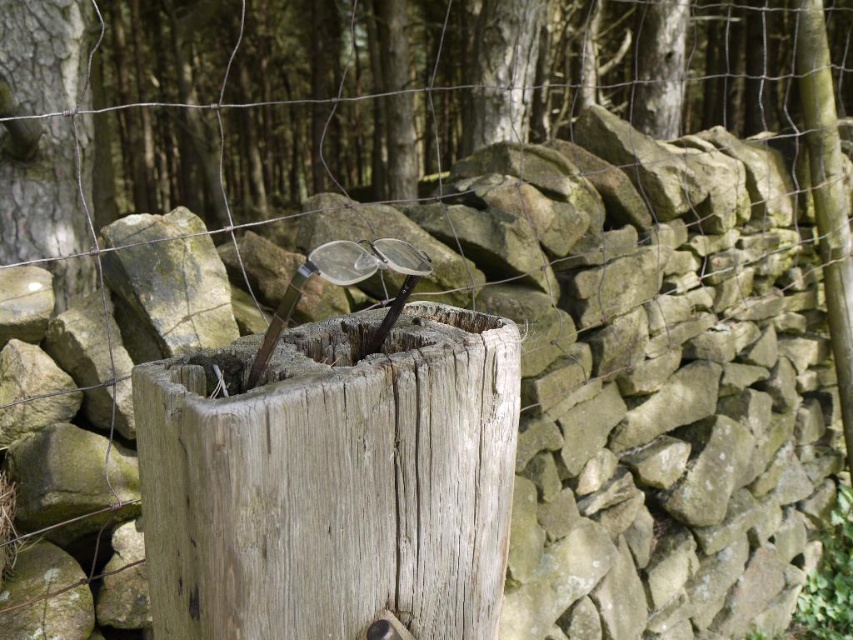
You are an artist setting up a still life. You have two objects in front of you, the weathered wood at center and the smooth bark tree trunk at center. Which object is positioned lower in the scene?

The weathered wood at center is positioned lower because it is below the smooth bark tree trunk at center.

Looking at this image, you are standing in front of the rustic outdoor scene and notice two objects at the center. Which one is located to the right of the other? The objects are the weathered wood at center and the smooth bark tree trunk at center.

The weathered wood at center is positioned on the right side of smooth bark tree trunk at center.

You are standing in a rustic outdoor setting and see the weathered wood at center. If you move 0.1 units to the right along the x axis, will you be closer to the dry stone wall?

The weathered wood at center is located at point (x=332, y=481). Moving 0.1 units to the right along the x axis would bring you to x coordinate 0.852. Since the dry stone wall is behind the weathered wood, moving to the right would not necessarily bring you closer to the wall. The distance to the wall depends on its position relative to the x axis movement, which isn not specified in the description. Therefore, it is unclear if moving right along the x axis would make you closer to the dry stone wall.